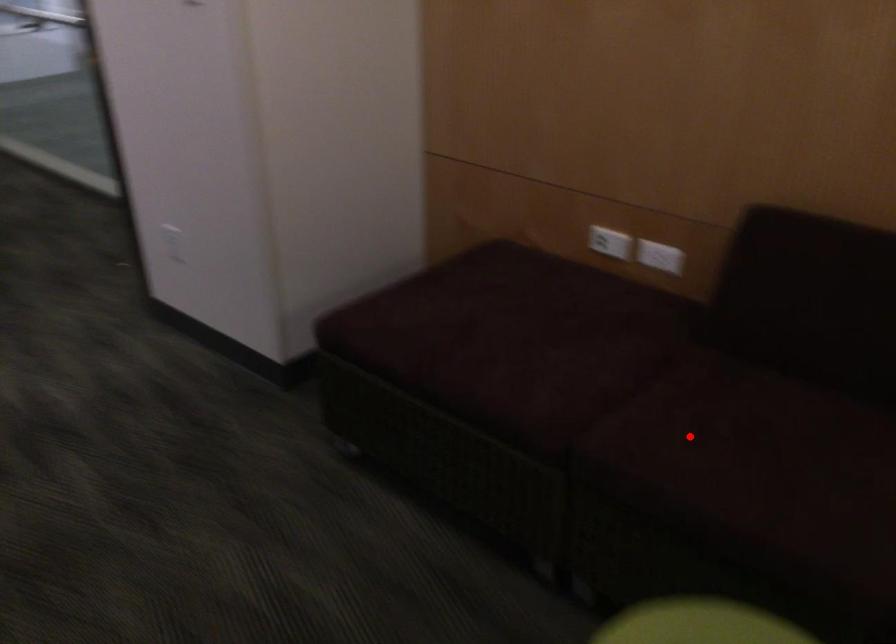
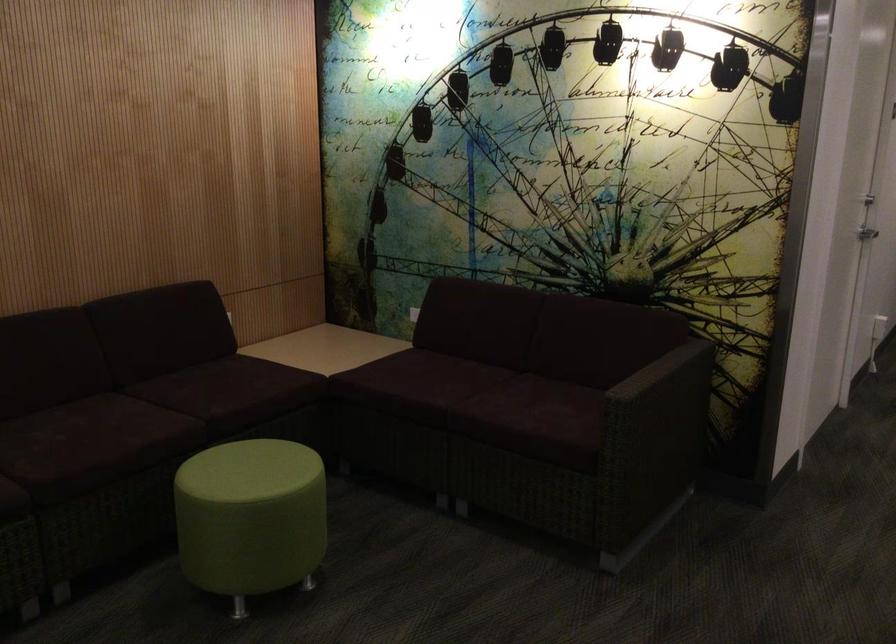
Question: A red point is marked in image1. In image2, is the corresponding 3D point closer to the camera or farther? Reply with the corresponding letter.

Choices:
 (A) The corresponding 3D point is closer.
 (B) The corresponding 3D point is farther.

Answer: (B)